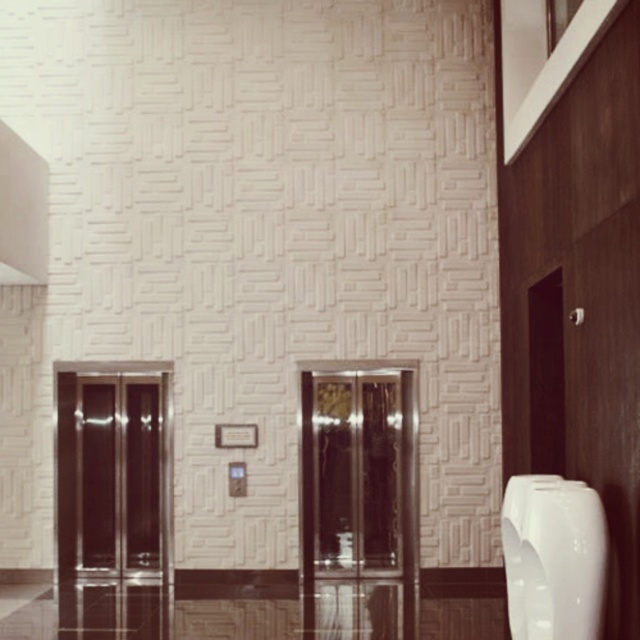
Which of these two, shiny metallic elevator doors at left or white glossy urinal at right, stands shorter?

Standing shorter between the two is white glossy urinal at right.

Is point (58, 497) farther from camera compared to point (556, 500)?

Yes, it is.

Is point (61, 451) closer to camera compared to point (557, 608)?

No, it is behind (557, 608).

Image resolution: width=640 pixels, height=640 pixels. Find the location of `shiny metallic elevator doors at left`. shiny metallic elevator doors at left is located at coordinates (115, 474).

Does point (348, 468) come closer to viewer compared to point (112, 541)?

No, it is behind (112, 541).

Which is in front, point (314, 445) or point (92, 477)?

Point (314, 445) is more forward.

At what (x,y) coordinates should I click in order to perform the action: click on shiny glass elevator at center. Please return your answer as a coordinate pair (x, y). Looking at the image, I should click on (358, 476).

Between shiny glass elevator at center and white glossy urinal at right, which one is positioned higher?

shiny glass elevator at center is higher up.

Which is behind, point (381, 548) or point (560, 598)?

Positioned behind is point (381, 548).

Between point (320, 404) and point (570, 620), which one is positioned behind?

The point (320, 404) is behind.

Identify the location of shiny glass elevator at center. (358, 476).